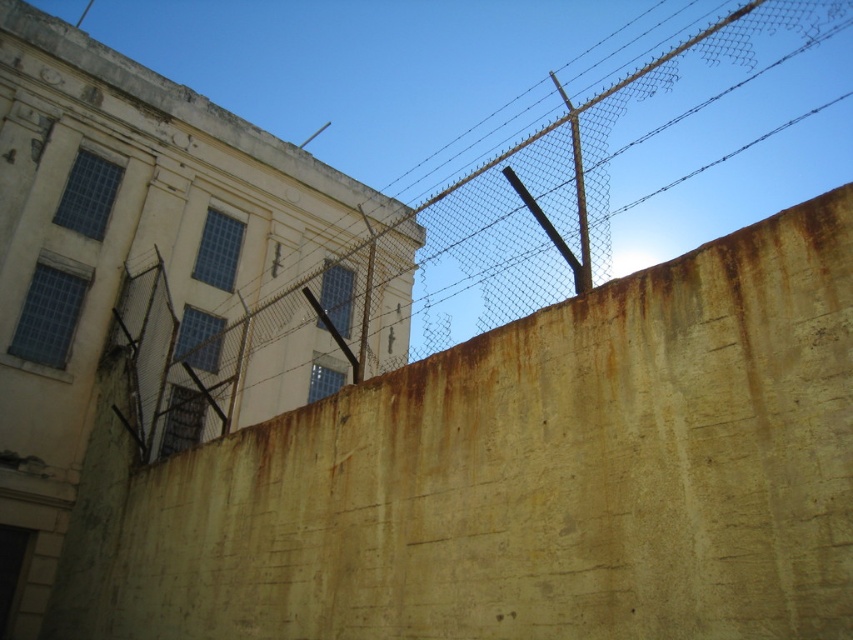
You are a maintenance worker standing 3 meters away from the rusty concrete wall at lower left. Can you reach it without moving closer?

The distance between you and the rusty concrete wall at lower left is 3.19 meters, which is slightly more than 3 meters. Therefore, you cannot reach it without moving closer.

Looking at this image, you are a construction inspector evaluating the structural integrity of the prison walls. You observe the rusty concrete wall at lower left and the rusty concrete fence at upper right. Which of these two structures has a greater thickness?

The rusty concrete wall at lower left is thinner than the rusty concrete fence at upper right, so the rusty concrete fence at upper right has greater thickness.